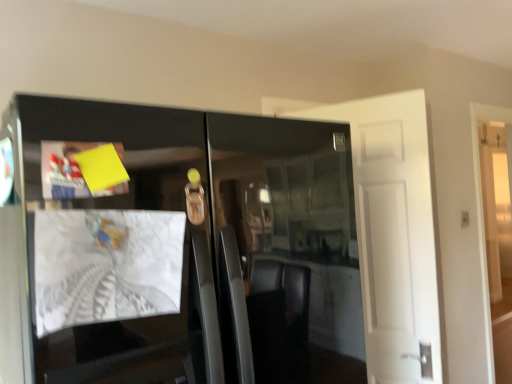
Question: Considering the relative sizes of glossy black cabinet at center and yellow paper at upper left, the 2th magazine positioned from the bottom, in the image provided, is glossy black cabinet at center wider than yellow paper at upper left, the 2th magazine positioned from the bottom,?

Choices:
 (A) no
 (B) yes

Answer: (B)

Question: Would you say glossy black cabinet at center is outside yellow paper at upper left, the first magazine from the top?

Choices:
 (A) no
 (B) yes

Answer: (B)

Question: Does glossy black cabinet at center turn towards yellow paper at upper left, the first magazine from the top?

Choices:
 (A) no
 (B) yes

Answer: (B)

Question: From the image's perspective, is glossy black cabinet at center located above yellow paper at upper left, the first magazine from the top?

Choices:
 (A) no
 (B) yes

Answer: (A)

Question: From the image's perspective, is glossy black cabinet at center under yellow paper at upper left, the first magazine from the top?

Choices:
 (A) no
 (B) yes

Answer: (B)

Question: From their relative heights in the image, would you say white paper at left, placed as the second magazine when sorted from top to bottom, is taller or shorter than glossy black cabinet at center?

Choices:
 (A) tall
 (B) short

Answer: (B)

Question: Is point (66, 241) closer or farther from the camera than point (249, 168)?

Choices:
 (A) closer
 (B) farther

Answer: (A)

Question: In the image, is white paper at left, placed as the second magazine when sorted from top to bottom, on the left side or the right side of glossy black cabinet at center?

Choices:
 (A) right
 (B) left

Answer: (B)

Question: Looking at the image, does white paper at left, arranged as the 1th magazine when ordered from the bottom, seem bigger or smaller compared to glossy black cabinet at center?

Choices:
 (A) small
 (B) big

Answer: (A)

Question: Looking at their shapes, would you say yellow paper at upper left, the first magazine from the top, is wider or thinner than glossy black cabinet at center?

Choices:
 (A) thin
 (B) wide

Answer: (A)

Question: Is point [x=67, y=144] closer or farther from the camera than point [x=28, y=322]?

Choices:
 (A) farther
 (B) closer

Answer: (B)

Question: From the image's perspective, relative to glossy black cabinet at center, is yellow paper at upper left, the 2th magazine positioned from the bottom, above or below?

Choices:
 (A) above
 (B) below

Answer: (A)

Question: Considering the positions of yellow paper at upper left, the first magazine from the top, and glossy black cabinet at center in the image, is yellow paper at upper left, the first magazine from the top, taller or shorter than glossy black cabinet at center?

Choices:
 (A) tall
 (B) short

Answer: (B)

Question: From a real-world perspective, is white matte door at right, which is counted as the first door, starting from the back, positioned above or below yellow paper at upper left, the first magazine from the top?

Choices:
 (A) above
 (B) below

Answer: (B)

Question: In terms of width, does white matte door at right, which is counted as the first door, starting from the back, look wider or thinner when compared to yellow paper at upper left, the first magazine from the top?

Choices:
 (A) thin
 (B) wide

Answer: (B)